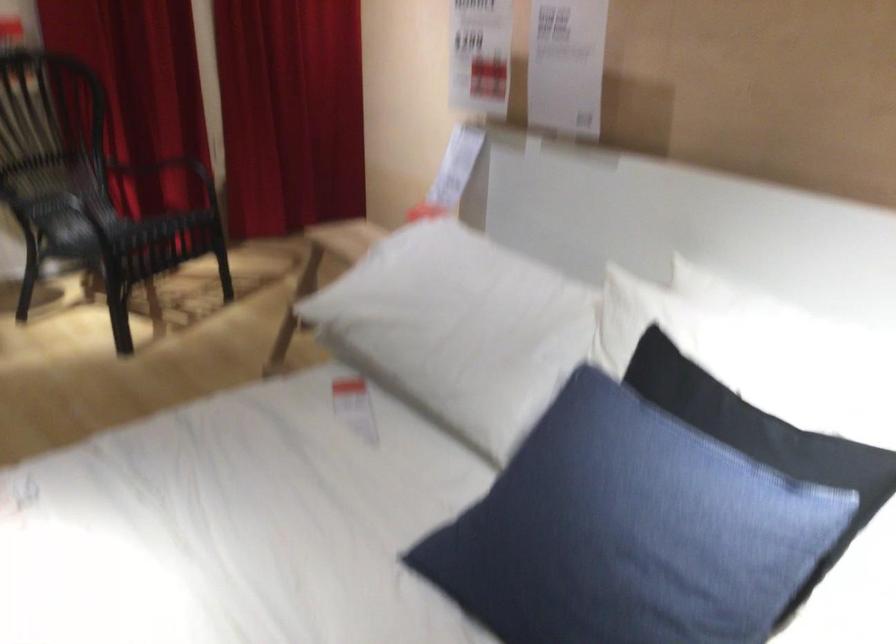
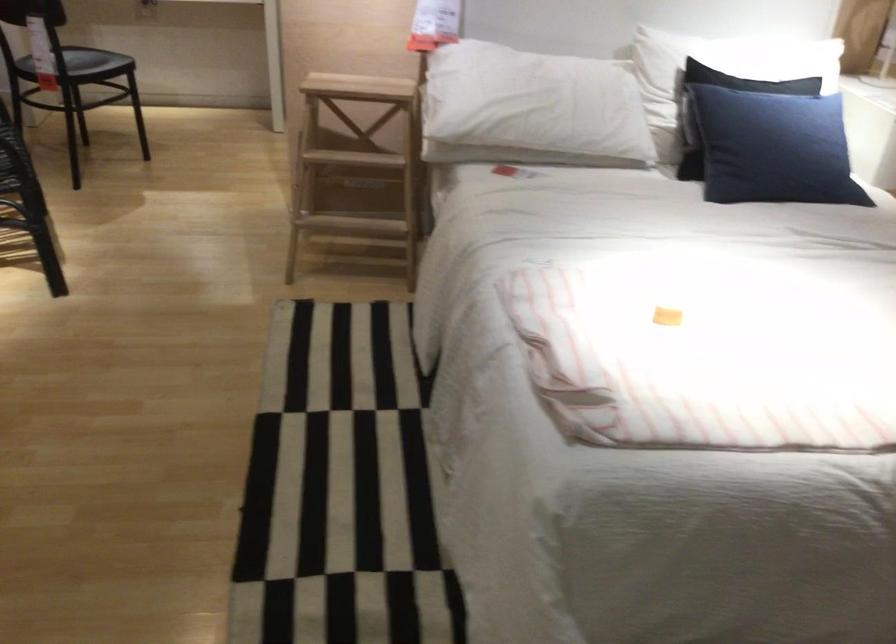
Find the pixel in the second image that matches [546,538] in the first image.

(773, 147)